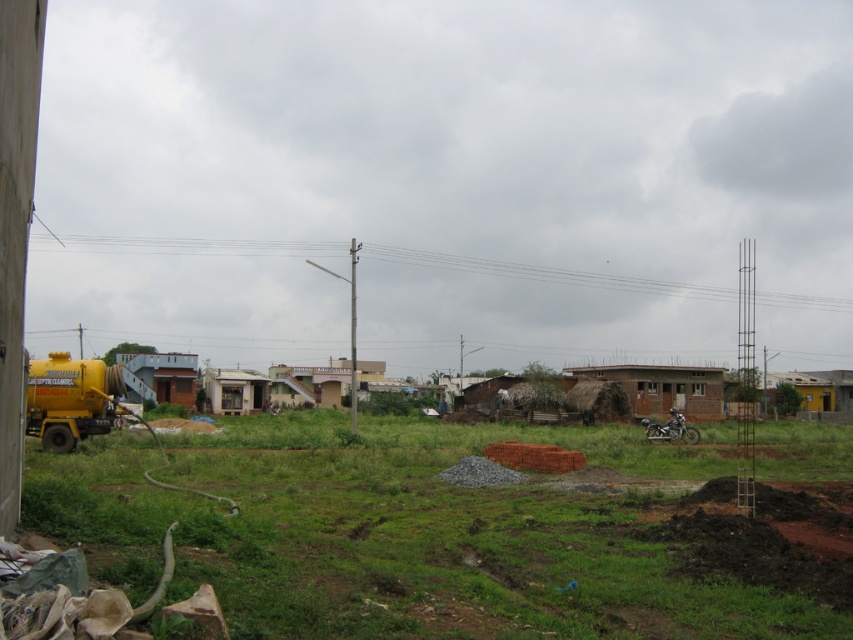
Between yellow metallic truck at left and brown brick hut at center, which one appears on the left side from the viewer's perspective?

Positioned to the left is yellow metallic truck at left.

Which of these two, yellow metallic truck at left or brown brick hut at center, stands taller?

yellow metallic truck at left is taller.

Which is behind, point (267, 448) or point (654, 401)?

Point (654, 401)

Where is `yellow metallic truck at left`? Image resolution: width=853 pixels, height=640 pixels. yellow metallic truck at left is located at coordinates (405, 534).

Is brown brick hut at center closer to camera compared to brown brick hut at center-left?

No, brown brick hut at center is further to the viewer.

Who is lower down, brown brick hut at center or brown brick hut at center-left?

brown brick hut at center

Is point (682, 396) behind point (172, 392)?

That is False.

Image resolution: width=853 pixels, height=640 pixels. I want to click on brown brick hut at center, so click(x=663, y=387).

Does point (669, 404) lie behind point (241, 403)?

No, (669, 404) is in front of (241, 403).

Who is taller, brown brick hut at center or white painted wood hut at center?

With more height is brown brick hut at center.

Is point (717, 394) positioned before point (242, 378)?

Yes, it is in front of point (242, 378).

Find the location of a particular element. This screenshot has height=640, width=853. brown brick hut at center is located at coordinates (663, 387).